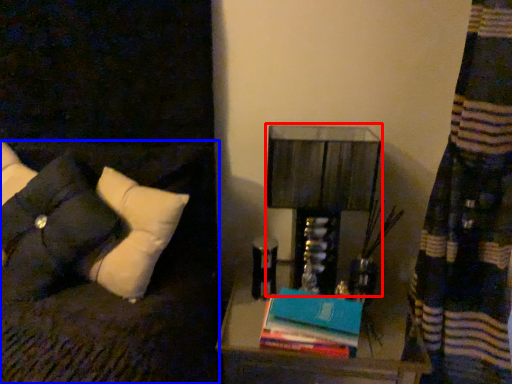
Question: Which of the following is the closest to the observer, table lamp (highlighted by a red box) or furniture (highlighted by a blue box)?

Choices:
 (A) table lamp
 (B) furniture

Answer: (B)